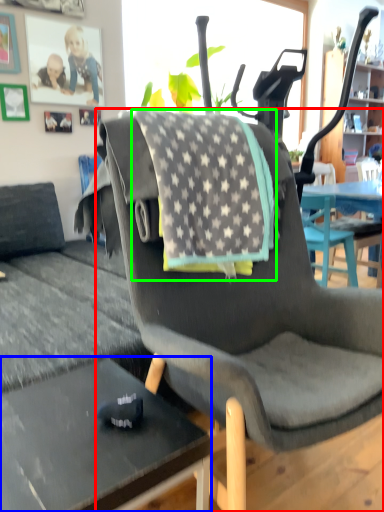
Question: Which is nearer to the chair (highlighted by a red box)? desk (highlighted by a blue box) or blanket (highlighted by a green box).

Choices:
 (A) desk
 (B) blanket

Answer: (B)